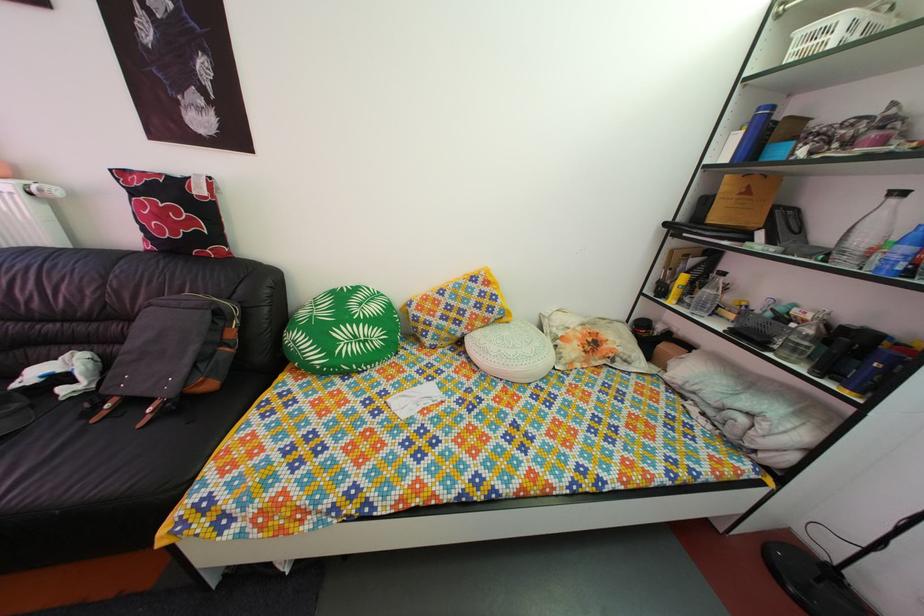
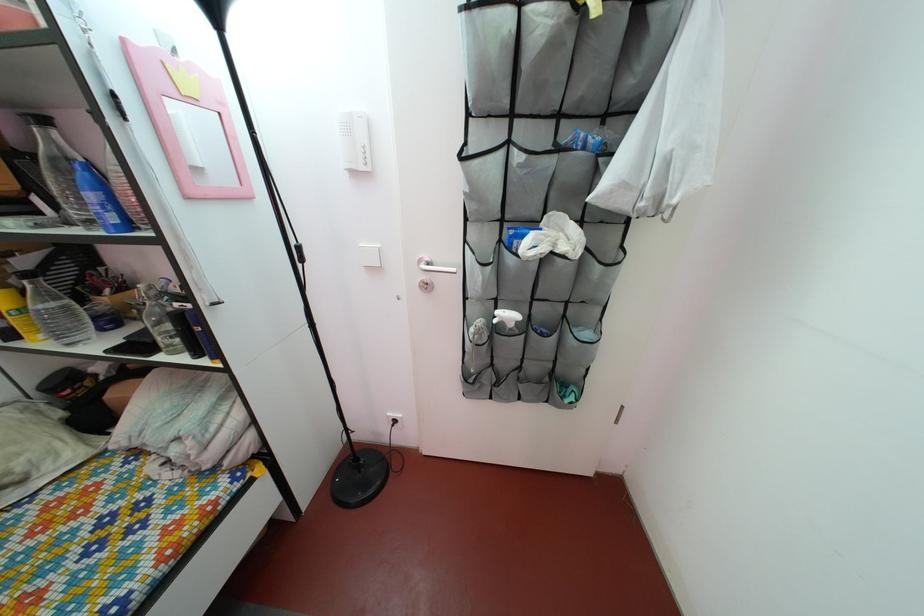
Locate, in the second image, the point that corresponds to pixel 685 300 in the first image.

(27, 330)